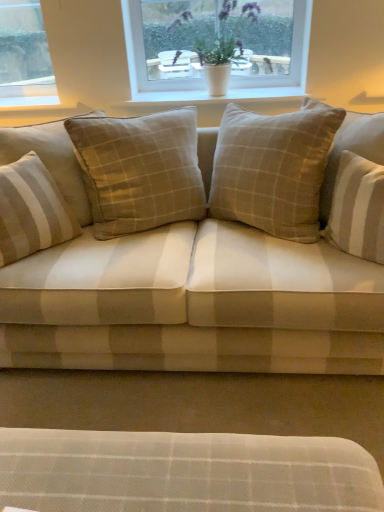
Question: Can you confirm if beige plaid fabric couch at center is positioned to the right of beige striped cushion at left, placed as the second pillow when sorted from right to left?

Choices:
 (A) yes
 (B) no

Answer: (A)

Question: Is beige plaid fabric couch at center bigger than beige striped cushion at left, placed as the second pillow when sorted from right to left?

Choices:
 (A) no
 (B) yes

Answer: (B)

Question: From a real-world perspective, is beige plaid fabric couch at center over beige striped cushion at left, the first pillow positioned from the left?

Choices:
 (A) yes
 (B) no

Answer: (B)

Question: Can you confirm if beige plaid fabric couch at center is wider than beige striped cushion at left, placed as the second pillow when sorted from right to left?

Choices:
 (A) no
 (B) yes

Answer: (B)

Question: Is beige plaid fabric couch at center oriented away from beige striped cushion at left, the first pillow positioned from the left?

Choices:
 (A) no
 (B) yes

Answer: (B)

Question: Is beige plaid fabric couch at center closer to the viewer compared to beige striped cushion at left, placed as the second pillow when sorted from right to left?

Choices:
 (A) yes
 (B) no

Answer: (A)

Question: Does beige checkered pillow at center, which appears as the 1th pillow when viewed from the right, have a lesser width compared to beige striped cushion at left, the first pillow positioned from the left?

Choices:
 (A) no
 (B) yes

Answer: (B)

Question: From the image's perspective, does beige checkered pillow at center, positioned as the 2th pillow in left-to-right order, appear higher than beige striped cushion at left, placed as the second pillow when sorted from right to left?

Choices:
 (A) yes
 (B) no

Answer: (A)

Question: From the image's perspective, is beige checkered pillow at center, positioned as the 2th pillow in left-to-right order, below beige striped cushion at left, the first pillow positioned from the left?

Choices:
 (A) no
 (B) yes

Answer: (A)

Question: Is beige checkered pillow at center, positioned as the 2th pillow in left-to-right order, at the left side of beige striped cushion at left, the first pillow positioned from the left?

Choices:
 (A) no
 (B) yes

Answer: (A)

Question: From a real-world perspective, is beige checkered pillow at center, which appears as the 1th pillow when viewed from the right, physically below beige striped cushion at left, the first pillow positioned from the left?

Choices:
 (A) no
 (B) yes

Answer: (A)

Question: Is beige checkered pillow at center, which appears as the 1th pillow when viewed from the right, outside of beige striped cushion at left, placed as the second pillow when sorted from right to left?

Choices:
 (A) yes
 (B) no

Answer: (A)

Question: Does beige plaid fabric couch at center lie in front of white plastic window at upper center?

Choices:
 (A) no
 (B) yes

Answer: (B)